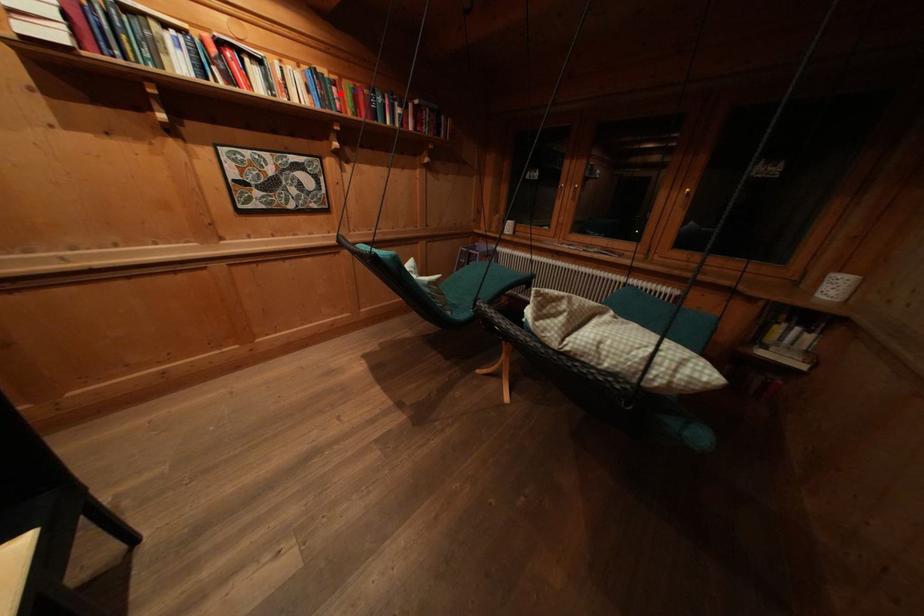
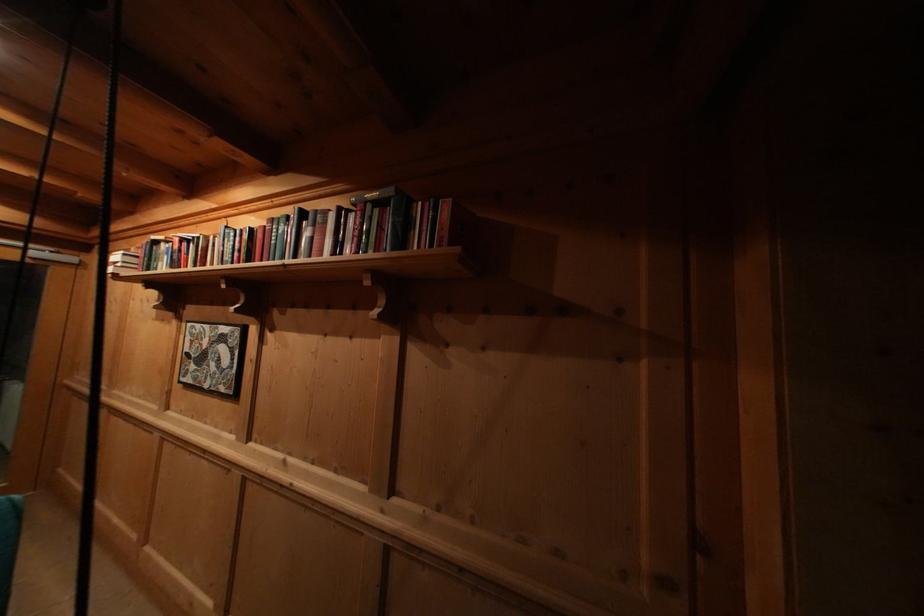
Question: I am providing you with two images of the same scene from different viewpoints. A red point is marked on the first image. Is the red point's position out of view in image 2?

Choices:
 (A) Yes
 (B) No

Answer: (B)